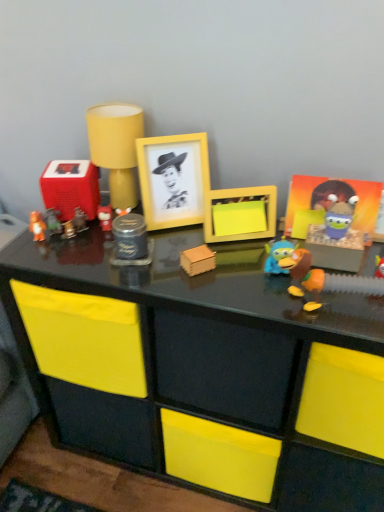
The image size is (384, 512). Describe the element at coordinates (68, 230) in the screenshot. I see `metallic gold toy at center-left, the 4th toy when ordered from left to right` at that location.

Locate an element on the screen. This screenshot has height=512, width=384. matte black hello kitty at center, which appears as the 7th toy when viewed from the right is located at coordinates (105, 217).

The height and width of the screenshot is (512, 384). Find the location of `metallic brown figurine at left, which ranks as the eighth toy in right-to-left order`. metallic brown figurine at left, which ranks as the eighth toy in right-to-left order is located at coordinates (79, 220).

At what (x,y) coordinates should I click in order to perform the action: click on rubberized plastic speaker at left, the tenth toy viewed from the right. Please return your answer as a coordinate pair (x, y). Looking at the image, I should click on (71, 188).

Locate an element on the screen. This screenshot has height=512, width=384. plush yellow lion at right, the 1th toy from the right is located at coordinates (321, 273).

Locate an element on the screen. The height and width of the screenshot is (512, 384). matte yellow lampshade at upper center, which is the 6th toy in right-to-left order is located at coordinates pos(116,148).

Locate an element on the screen. shiny metallic can at center, positioned as the 5th toy in right-to-left order is located at coordinates (130, 241).

Is plush yellow lion at right, positioned as the twelfth toy in left-to-right order, at the back of matte black hello kitty at center, the sixth toy when ordered from left to right?

No.

Consider the image. Considering the positions of objects matte black hello kitty at center, the sixth toy when ordered from left to right, and plush yellow lion at right, the 1th toy from the right, in the image provided, who is behind, matte black hello kitty at center, the sixth toy when ordered from left to right, or plush yellow lion at right, the 1th toy from the right,?

matte black hello kitty at center, the sixth toy when ordered from left to right.

Considering the relative sizes of matte black hello kitty at center, the sixth toy when ordered from left to right, and plush yellow lion at right, positioned as the twelfth toy in left-to-right order, in the image provided, is matte black hello kitty at center, the sixth toy when ordered from left to right, thinner than plush yellow lion at right, positioned as the twelfth toy in left-to-right order,?

Yes.

Is point (78, 167) positioned in front of point (157, 197)?

Yes, it is in front of point (157, 197).

Visually, is rubberized plastic speaker at left, the tenth toy viewed from the right, positioned to the left or to the right of yellow matte picture frame at upper center?

rubberized plastic speaker at left, the tenth toy viewed from the right, is to the left of yellow matte picture frame at upper center.

Which object is further away from the camera, rubberized plastic speaker at left, placed as the 3th toy when sorted from left to right, or yellow matte picture frame at upper center?

rubberized plastic speaker at left, placed as the 3th toy when sorted from left to right.

Which of these two, rubberized plastic speaker at left, the tenth toy viewed from the right, or yellow matte picture frame at upper center, stands shorter?

With less height is rubberized plastic speaker at left, the tenth toy viewed from the right.

From the image's perspective, is shiny metallic can at center, which appears as the 8th toy when viewed from the left, below metallic gold toy at center-left, the 4th toy when ordered from left to right?

Indeed, from the image's perspective, shiny metallic can at center, which appears as the 8th toy when viewed from the left, is shown beneath metallic gold toy at center-left, the 4th toy when ordered from left to right.

Considering the sizes of objects shiny metallic can at center, positioned as the 5th toy in right-to-left order, and metallic gold toy at center-left, the 4th toy when ordered from left to right, in the image provided, who is smaller, shiny metallic can at center, positioned as the 5th toy in right-to-left order, or metallic gold toy at center-left, the 4th toy when ordered from left to right,?

Smaller between the two is metallic gold toy at center-left, the 4th toy when ordered from left to right.

Does point (142, 250) appear closer or farther from the camera than point (70, 227)?

Point (142, 250).

Would you say yellow matte picture frame at upper center is a long distance from yellow matte frame at center, which is counted as the tenth toy, starting from the left?

No, yellow matte picture frame at upper center is not far away from yellow matte frame at center, which is counted as the tenth toy, starting from the left.

Can you confirm if yellow matte picture frame at upper center is shorter than yellow matte frame at center, the third toy positioned from the right?

No.

Which object is more forward, yellow matte picture frame at upper center or yellow matte frame at center, the third toy positioned from the right?

Positioned in front is yellow matte frame at center, the third toy positioned from the right.

From the image's perspective, is yellow matte picture frame at upper center below yellow matte frame at center, which is counted as the tenth toy, starting from the left?

Incorrect, from the image's perspective, yellow matte picture frame at upper center is higher than yellow matte frame at center, which is counted as the tenth toy, starting from the left.

Can you tell me how much matte black hello kitty at center, the sixth toy when ordered from left to right, and wooden block at center, which is counted as the 4th toy, starting from the right, differ in facing direction?

4.25 degrees separate the facing orientations of matte black hello kitty at center, the sixth toy when ordered from left to right, and wooden block at center, which is counted as the 4th toy, starting from the right.

In the image, is matte black hello kitty at center, which appears as the 7th toy when viewed from the right, positioned in front of or behind wooden block at center, positioned as the ninth toy in left-to-right order?

In the image, matte black hello kitty at center, which appears as the 7th toy when viewed from the right, appears behind wooden block at center, positioned as the ninth toy in left-to-right order.

Is matte black hello kitty at center, the sixth toy when ordered from left to right, far away from wooden block at center, which is counted as the 4th toy, starting from the right?

That's not correct — matte black hello kitty at center, the sixth toy when ordered from left to right, is a little close to wooden block at center, which is counted as the 4th toy, starting from the right.

Does matte black hello kitty at center, which appears as the 7th toy when viewed from the right, turn towards wooden block at center, which is counted as the 4th toy, starting from the right?

No, matte black hello kitty at center, which appears as the 7th toy when viewed from the right, does not turn towards wooden block at center, which is counted as the 4th toy, starting from the right.

Can you confirm if blue rubber duck at center, marked as the second toy in a right-to-left arrangement, is positioned to the right of rubberized plastic speaker at left, the tenth toy viewed from the right?

Correct, you'll find blue rubber duck at center, marked as the second toy in a right-to-left arrangement, to the right of rubberized plastic speaker at left, the tenth toy viewed from the right.

Based on the photo, does blue rubber duck at center, which is counted as the eleventh toy, starting from the left, have a lesser width compared to rubberized plastic speaker at left, placed as the 3th toy when sorted from left to right?

Yes, blue rubber duck at center, which is counted as the eleventh toy, starting from the left, is thinner than rubberized plastic speaker at left, placed as the 3th toy when sorted from left to right.

Could you tell me if blue rubber duck at center, marked as the second toy in a right-to-left arrangement, is turned towards rubberized plastic speaker at left, placed as the 3th toy when sorted from left to right?

No, blue rubber duck at center, marked as the second toy in a right-to-left arrangement, is not facing towards rubberized plastic speaker at left, placed as the 3th toy when sorted from left to right.

Is blue rubber duck at center, marked as the second toy in a right-to-left arrangement, positioned far away from rubberized plastic speaker at left, the tenth toy viewed from the right?

No, blue rubber duck at center, marked as the second toy in a right-to-left arrangement, is in close proximity to rubberized plastic speaker at left, the tenth toy viewed from the right.

Between matte brown figurine at left, the second toy when ordered from left to right, and metallic gold toy at center-left, the 4th toy when ordered from left to right, which one has larger width?

matte brown figurine at left, the second toy when ordered from left to right, is wider.

Is point (46, 222) closer or farther from the camera than point (68, 222)?

Point (46, 222) is closer to the camera than point (68, 222).

From a real-world perspective, who is located higher, matte brown figurine at left, the second toy when ordered from left to right, or metallic gold toy at center-left, the 4th toy when ordered from left to right?

matte brown figurine at left, the second toy when ordered from left to right.

Could you measure the distance between matte brown figurine at left, acting as the eleventh toy starting from the right, and metallic gold toy at center-left, marked as the 9th toy in a right-to-left arrangement?

The distance of matte brown figurine at left, acting as the eleventh toy starting from the right, from metallic gold toy at center-left, marked as the 9th toy in a right-to-left arrangement, is 1.23 inches.

From the image's perspective, starting from the matte black hello kitty at center, which appears as the 7th toy when viewed from the right, which toy is the 8th one below? Please provide its 2D coordinates.

[(321, 273)]

This screenshot has height=512, width=384. Identify the location of the 6th toy counting from the left side of the yellow matte picture frame at upper center. (x=71, y=188).

Looking at the image, which one is located closer to wooden block at center, positioned as the ninth toy in left-to-right order, blue rubber duck at center, marked as the second toy in a right-to-left arrangement, or orange matte bear at left, the twelfth toy in the right-to-left sequence?

blue rubber duck at center, marked as the second toy in a right-to-left arrangement, is closer to wooden block at center, positioned as the ninth toy in left-to-right order.

From the image, which object appears to be nearer to metallic brown figurine at left, which ranks as the eighth toy in right-to-left order, metallic gold toy at center-left, marked as the 9th toy in a right-to-left arrangement, or shiny metallic can at center, positioned as the 5th toy in right-to-left order?

metallic gold toy at center-left, marked as the 9th toy in a right-to-left arrangement, is positioned closer to the anchor metallic brown figurine at left, which ranks as the eighth toy in right-to-left order.

Based on their spatial positions, is matte brown figurine at left, the second toy when ordered from left to right, or yellow matte frame at center, which is counted as the tenth toy, starting from the left, closer to yellow matte picture frame at upper center?

yellow matte frame at center, which is counted as the tenth toy, starting from the left, is closer to yellow matte picture frame at upper center.

Estimate the real-world distances between objects in this image. Which object is further from blue rubber duck at center, marked as the second toy in a right-to-left arrangement, matte black hello kitty at center, which appears as the 7th toy when viewed from the right, or matte brown figurine at left, acting as the eleventh toy starting from the right?

matte brown figurine at left, acting as the eleventh toy starting from the right, lies further to blue rubber duck at center, marked as the second toy in a right-to-left arrangement, than the other object.

Considering their positions, is matte black hello kitty at center, which appears as the 7th toy when viewed from the right, positioned further to metallic brown figurine at left, the 5th toy when ordered from left to right, than plush yellow lion at right, positioned as the twelfth toy in left-to-right order?

plush yellow lion at right, positioned as the twelfth toy in left-to-right order, is further to metallic brown figurine at left, the 5th toy when ordered from left to right.

Looking at the image, which one is located further to matte black hello kitty at center, the sixth toy when ordered from left to right, glossy black desk at center or shiny metallic can at center, positioned as the 5th toy in right-to-left order?

Based on the image, glossy black desk at center appears to be further to matte black hello kitty at center, the sixth toy when ordered from left to right.

Based on the photo, based on their spatial positions, is matte brown figurine at left, acting as the eleventh toy starting from the right, or wooden block at center, positioned as the ninth toy in left-to-right order, further from yellow matte frame at center, which is counted as the tenth toy, starting from the left?

matte brown figurine at left, acting as the eleventh toy starting from the right, lies further to yellow matte frame at center, which is counted as the tenth toy, starting from the left, than the other object.

Estimate the real-world distances between objects in this image. Which object is further from yellow matte frame at center, which is counted as the tenth toy, starting from the left, yellow matte picture frame at upper center or matte black hello kitty at center, which appears as the 7th toy when viewed from the right?

matte black hello kitty at center, which appears as the 7th toy when viewed from the right, is further to yellow matte frame at center, which is counted as the tenth toy, starting from the left.

Locate an element on the screen. The width and height of the screenshot is (384, 512). toy between shiny metallic can at center, positioned as the 5th toy in right-to-left order, and yellow matte frame at center, the third toy positioned from the right, in the horizontal direction is located at coordinates (197, 260).

Locate an element on the screen. picture frame between metallic gold toy at center-left, the 4th toy when ordered from left to right, and blue rubber duck at center, which is counted as the eleventh toy, starting from the left is located at coordinates (173, 179).

Locate an element on the screen. This screenshot has width=384, height=512. picture frame located between shiny metallic can at center, positioned as the 5th toy in right-to-left order, and plush yellow lion at right, positioned as the twelfth toy in left-to-right order, in the left-right direction is located at coordinates (173, 179).

In order to click on desk located between matte black hello kitty at center, the sixth toy when ordered from left to right, and plush yellow lion at right, positioned as the twelfth toy in left-to-right order, in the left-right direction in this screenshot , I will do `click(203, 361)`.